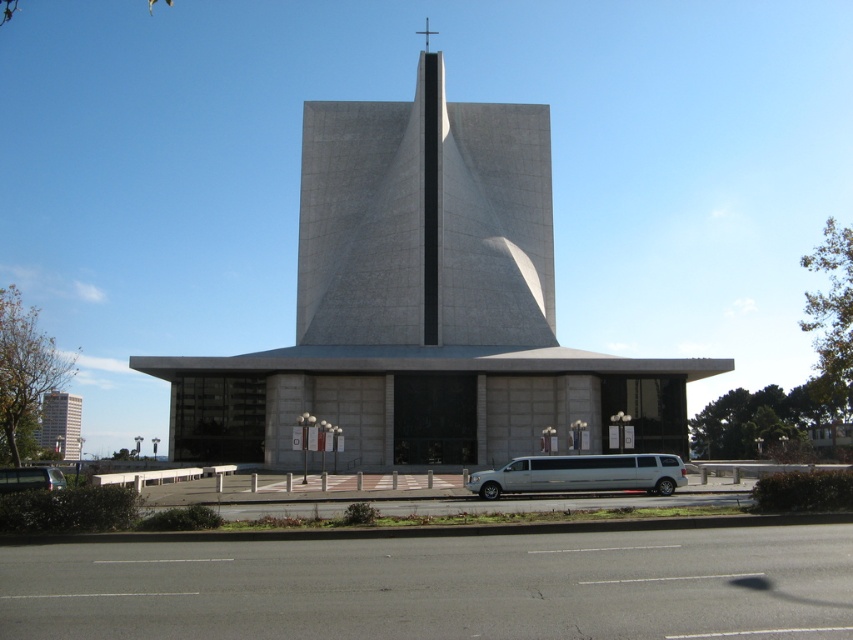
Does silver metallic limousine at lower center have a lesser height compared to brick tower at left?

Indeed, silver metallic limousine at lower center has a lesser height compared to brick tower at left.

Between point (613, 472) and point (57, 420), which one is positioned behind?

The point (57, 420) is behind.

You are a GUI agent. You are given a task and a screenshot of the screen. Output one action in this format:
    pyautogui.click(x=<x>, y=<y>)
    Task: Click on the silver metallic limousine at lower center
    
    Given the screenshot: What is the action you would take?
    pyautogui.click(x=581, y=474)

Between smooth concrete church at center and metallic silver van at lower left, which one appears on the right side from the viewer's perspective?

Positioned to the right is smooth concrete church at center.

Which is behind, point (322, 220) or point (48, 486)?

The point (322, 220) is behind.

At what (x,y) coordinates should I click in order to perform the action: click on smooth concrete church at center. Please return your answer as a coordinate pair (x, y). The width and height of the screenshot is (853, 640). Looking at the image, I should click on (422, 305).

Does brick tower at left have a lesser height compared to metallic silver van at lower left?

No, brick tower at left is not shorter than metallic silver van at lower left.

Between point (55, 410) and point (7, 484), which one is positioned in front?

Point (7, 484) is in front.

Is point (62, 442) in front of point (15, 484)?

No, it is not.

Locate an element on the screen. This screenshot has width=853, height=640. brick tower at left is located at coordinates (61, 422).